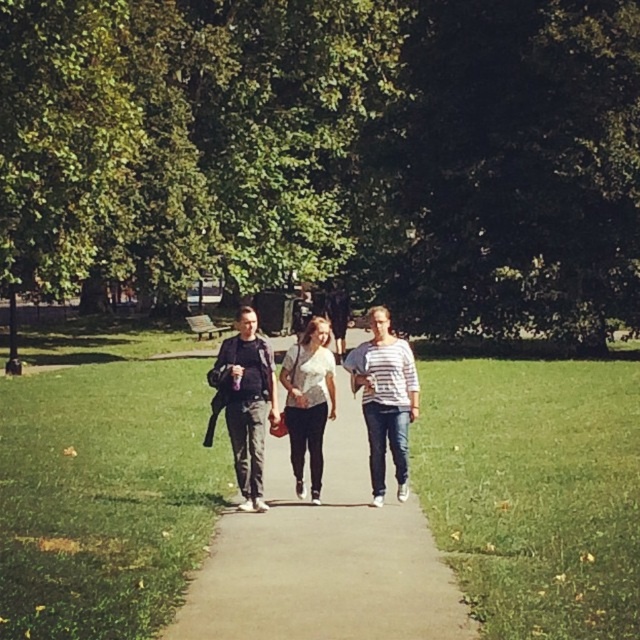
Question: Does smooth concrete path at center come behind white matte shirt at center?

Choices:
 (A) no
 (B) yes

Answer: (A)

Question: Is smooth concrete path at center above white striped shirt at center?

Choices:
 (A) yes
 (B) no

Answer: (B)

Question: Among these objects, which one is farthest from the camera?

Choices:
 (A) smooth concrete path at center
 (B) white striped shirt at center
 (C) white matte shirt at center

Answer: (C)

Question: Which of these objects is positioned closest to the smooth concrete path at center?

Choices:
 (A) white matte shirt at center
 (B) white striped shirt at center

Answer: (A)

Question: Which point is closer to the camera?

Choices:
 (A) (380, 468)
 (B) (324, 326)

Answer: (B)

Question: Is white striped shirt at center positioned before white matte shirt at center?

Choices:
 (A) no
 (B) yes

Answer: (B)